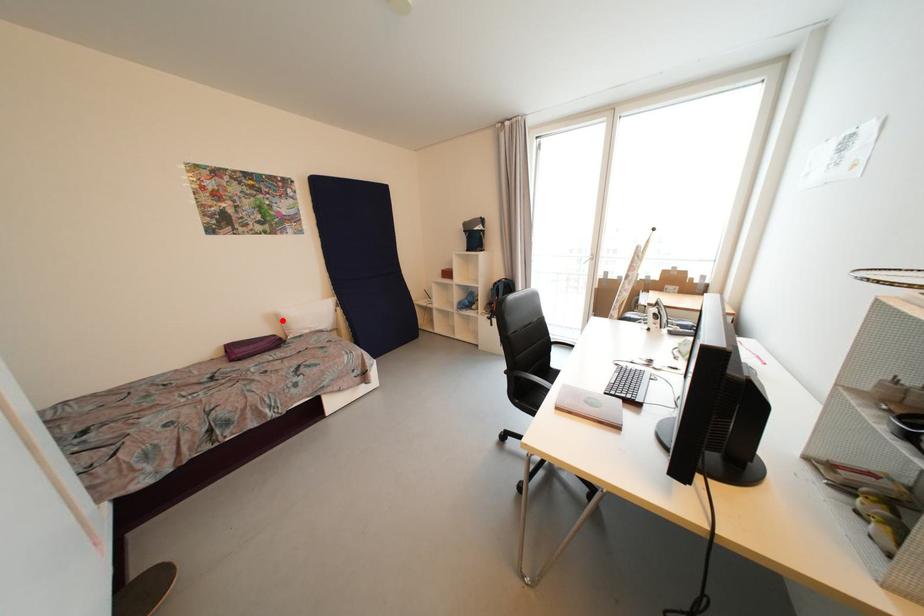
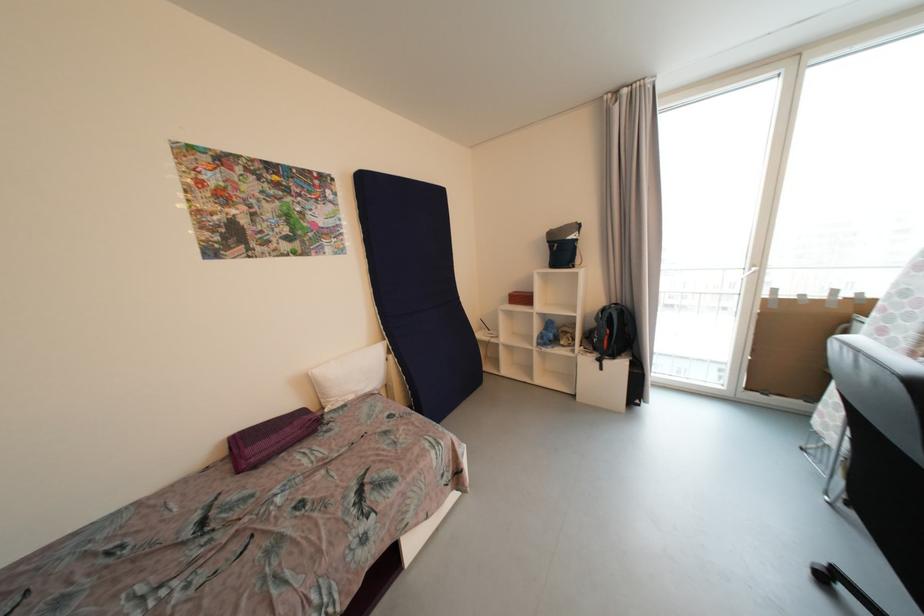
Question: A red point is marked in image1. In image2, is the corresponding 3D point closer to the camera or farther? Reply with the corresponding letter.

Choices:
 (A) The corresponding 3D point is closer.
 (B) The corresponding 3D point is farther.

Answer: (B)